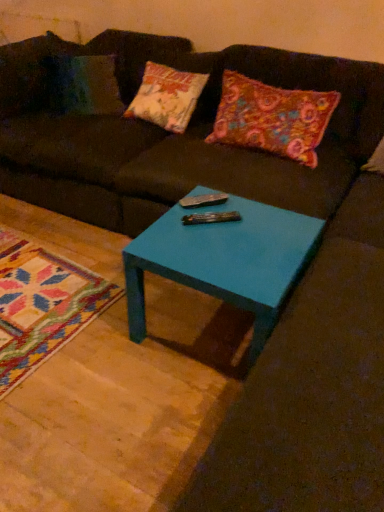
The image size is (384, 512). I want to click on vacant space to the left of metallic silver remote at center, so click(x=169, y=226).